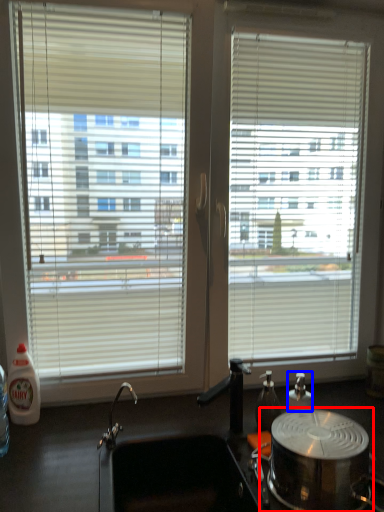
Question: Which of the following is the closest to the observer, appliance (highlighted by a red box) or bottle (highlighted by a blue box)?

Choices:
 (A) appliance
 (B) bottle

Answer: (A)